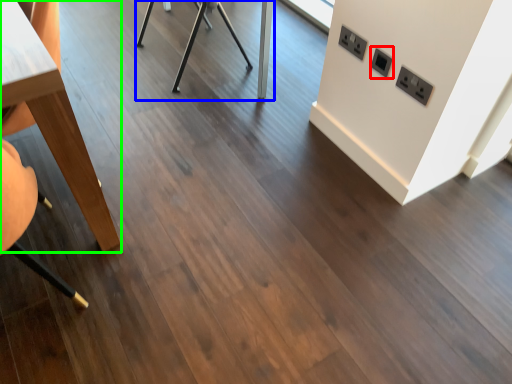
Question: Based on their relative distances, which object is farther from electric outlet (highlighted by a red box)? Choose from table (highlighted by a blue box) and table (highlighted by a green box).

Choices:
 (A) table
 (B) table

Answer: (A)